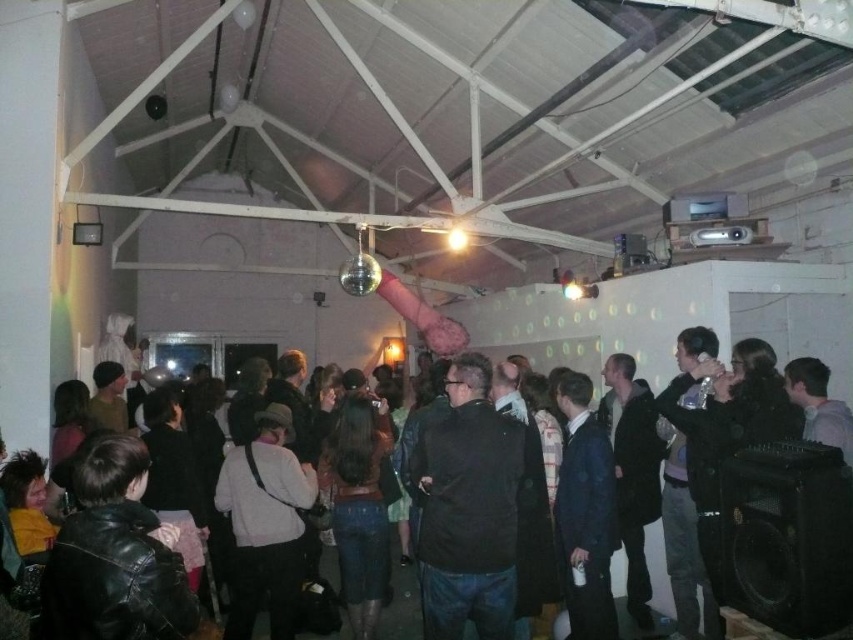
You are at a party and need to place a new item between the black matte speaker at lower right and the leather jacket at center. Since the speaker is larger, where should you position the new item to ensure it doesn

The black matte speaker at lower right is bigger than the leather jacket at center, so placing the new item closer to the leather jacket at center would allow more space for the larger speaker.

You are planning to place a new rectangular table in the room. The table is 1.5 meters wide. You see the black leather jacket at center and the black matte speaker at lower right. Which object should you avoid placing the table next to if you want to ensure there is enough space for people to walk around?

You should avoid placing the table next to the black leather jacket at center because its width is larger than the black matte speaker at lower right, which may leave less space for people to walk around.